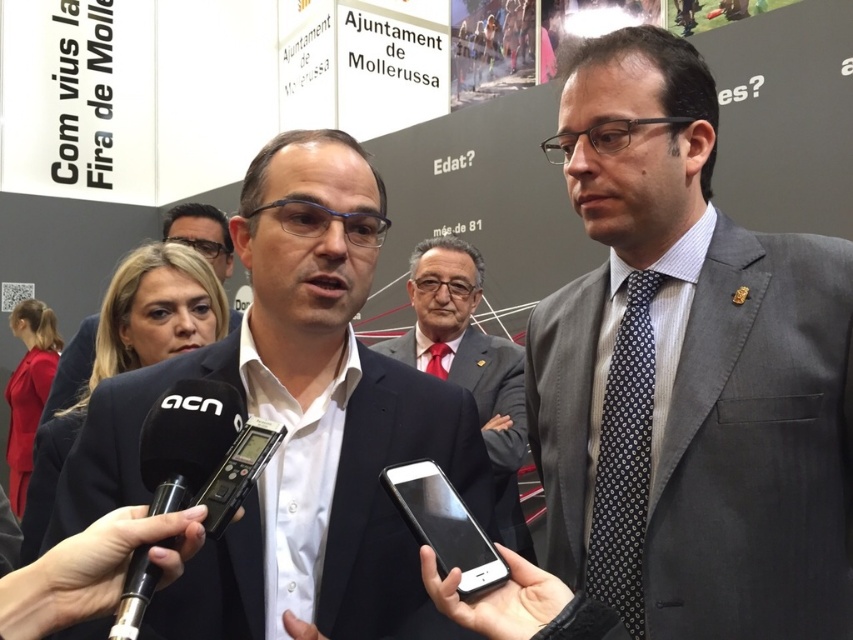
Which is behind, point (467, 342) or point (74, 348)?

The point (467, 342) is behind.

Is dark gray suit at center to the left of white shirt at center from the viewer's perspective?

In fact, dark gray suit at center is to the right of white shirt at center.

Which is in front, point (502, 536) or point (204, 220)?

Point (502, 536) is in front.

I want to click on dark gray suit at center, so click(469, 364).

Does point (532, 388) lie behind point (105, 452)?

Yes.

Between gray wool suit at right and matte black suit at center, which one is positioned higher?

matte black suit at center

Which is behind, point (677, 291) or point (271, 244)?

Positioned behind is point (677, 291).

Find the location of `gray wool suit at right`. gray wool suit at right is located at coordinates (750, 436).

Between gray wool suit at right and dark gray suit at center, which one has less height?

gray wool suit at right is shorter.

Describe the element at coordinates (750, 436) in the screenshot. I see `gray wool suit at right` at that location.

At what (x,y) coordinates should I click in order to perform the action: click on gray wool suit at right. Please return your answer as a coordinate pair (x, y). Image resolution: width=853 pixels, height=640 pixels. Looking at the image, I should click on (750, 436).